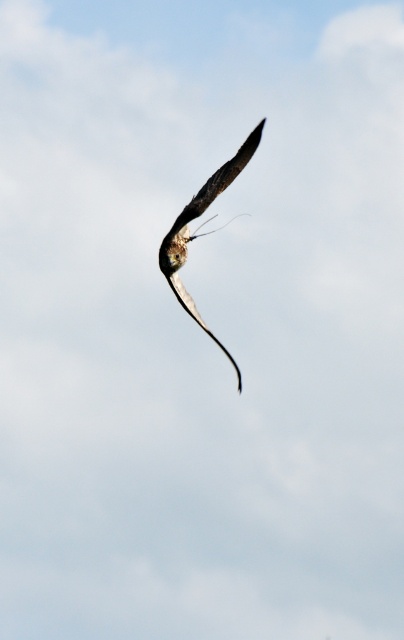
Looking at this image, between brown feathered bird at center and silvery metallic tail at center, which one is positioned lower?

silvery metallic tail at center

Between brown feathered bird at center and silvery metallic tail at center, which one appears on the left side from the viewer's perspective?

From the viewer's perspective, silvery metallic tail at center appears more on the left side.

I want to click on brown feathered bird at center, so click(202, 234).